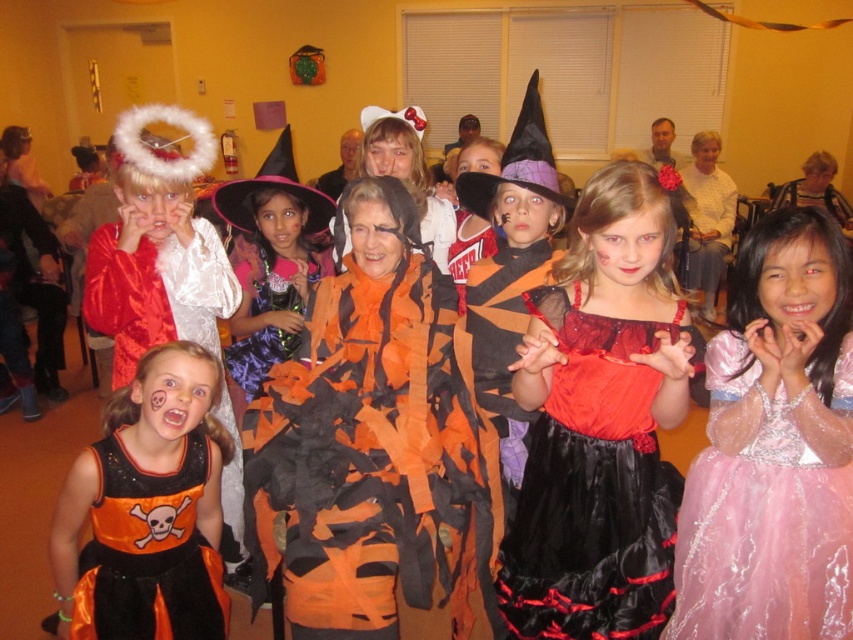
Question: Which point is farther to the camera?

Choices:
 (A) shiny silver halo at upper left
 (B) orange satin dress at center

Answer: (B)

Question: Does orange paper mache bat at center have a greater width compared to shiny satin dress at center?

Choices:
 (A) no
 (B) yes

Answer: (B)

Question: Among these points, which one is farthest from the camera?

Choices:
 (A) (409, 573)
 (B) (73, 595)

Answer: (B)

Question: Does orange paper mache bat at center have a greater width compared to purple felt witch hat at upper center?

Choices:
 (A) yes
 (B) no

Answer: (A)

Question: Which point is closer to the camera taking this photo?

Choices:
 (A) (694, 538)
 (B) (607, 392)
 (C) (397, 516)
 (D) (306, 301)

Answer: (C)

Question: Does orange paper mache bat at center have a greater width compared to orange satin dress at center?

Choices:
 (A) yes
 (B) no

Answer: (A)